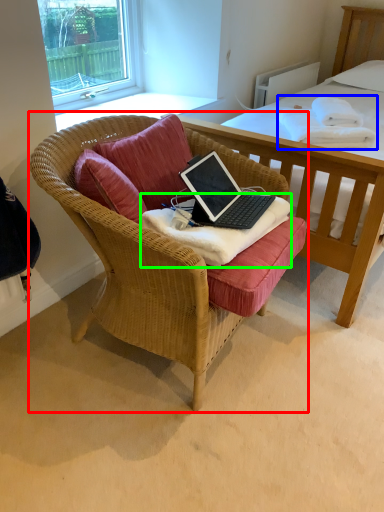
Question: Which object is the closest to the chair (highlighted by a red box)? Choose among these: blanket (highlighted by a blue box) or blanket (highlighted by a green box).

Choices:
 (A) blanket
 (B) blanket

Answer: (B)